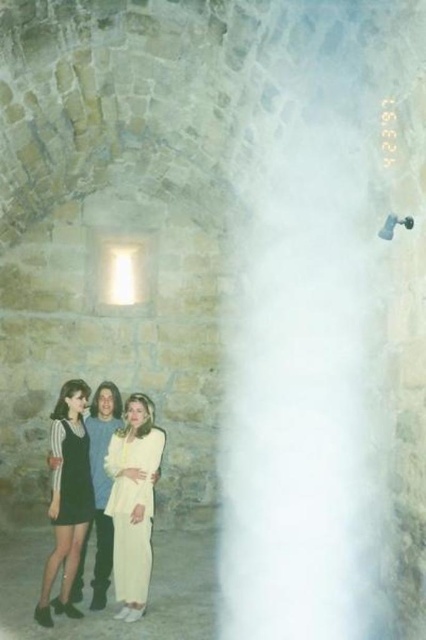
Question: Among these points, which one is farthest from the camera?

Choices:
 (A) (85, 486)
 (B) (58, 394)
 (C) (20, 602)

Answer: (B)

Question: Is light yellow fabric dress at center positioned in front of black satin dress at left?

Choices:
 (A) yes
 (B) no

Answer: (A)

Question: Among these objects, which one is nearest to the camera?

Choices:
 (A) light yellow fabric dress at center
 (B) black satin dress at left
 (C) matte black dress at left

Answer: (C)

Question: Can you confirm if light beige fabric skirt at lower left is bigger than light yellow fabric dress at center?

Choices:
 (A) no
 (B) yes

Answer: (B)

Question: Which point is farther from the camera taking this photo?

Choices:
 (A) (114, 438)
 (B) (54, 435)
 (C) (14, 609)
 (D) (68, 476)

Answer: (A)

Question: Does matte black dress at left have a larger size compared to black satin dress at left?

Choices:
 (A) yes
 (B) no

Answer: (A)